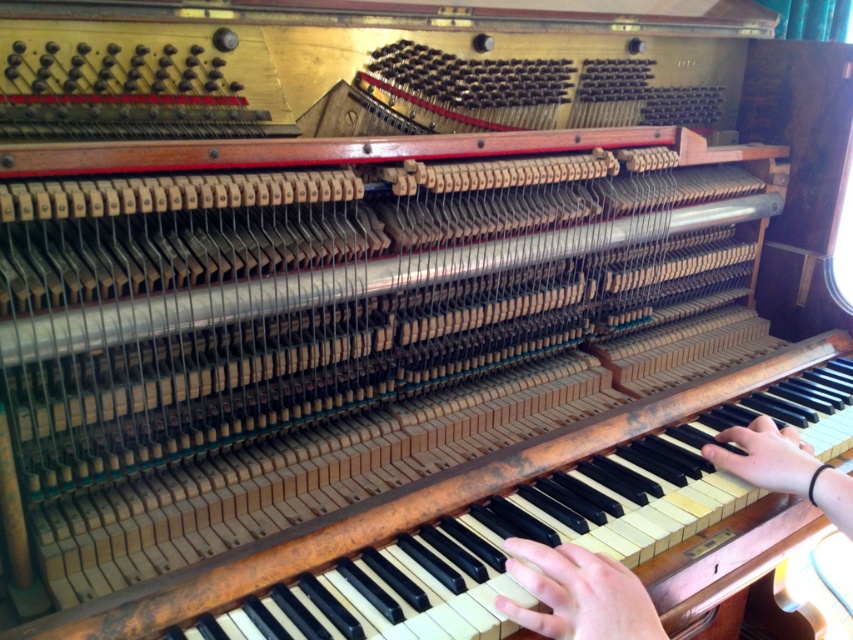
Describe the element at coordinates (578, 595) in the screenshot. I see `smooth skin hand at center` at that location.

Does smooth skin hand at center appear on the right side of light skin tone hand at right?

Indeed, smooth skin hand at center is positioned on the right side of light skin tone hand at right.

Is point (825, 486) behind point (758, 428)?

No, it is not.

Where is `smooth skin hand at center`? The width and height of the screenshot is (853, 640). smooth skin hand at center is located at coordinates (578, 595).

Can you confirm if smooth skin hand at center is positioned below light skin tone flesh at lower center?

Actually, smooth skin hand at center is above light skin tone flesh at lower center.

Who is higher up, smooth skin hand at center or light skin tone flesh at lower center?

smooth skin hand at center

What do you see at coordinates (578, 595) in the screenshot? I see `smooth skin hand at center` at bounding box center [578, 595].

At what (x,y) coordinates should I click in order to perform the action: click on smooth skin hand at center. Please return your answer as a coordinate pair (x, y). Looking at the image, I should click on (578, 595).

Is the position of light skin tone flesh at lower center more distant than that of light skin tone hand at right?

No, it is not.

Is light skin tone flesh at lower center to the right of light skin tone hand at right from the viewer's perspective?

No, light skin tone flesh at lower center is not to the right of light skin tone hand at right.

Where is `light skin tone flesh at lower center`? This screenshot has height=640, width=853. light skin tone flesh at lower center is located at coordinates (578, 593).